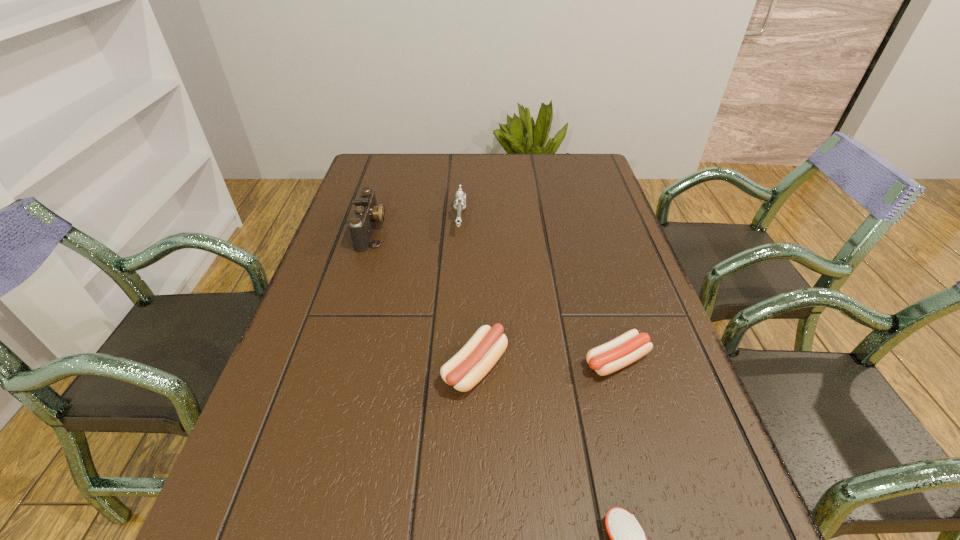
At what (x,y) coordinates should I click in order to perform the action: click on free spot between the third tallest object and the second shortest object. Please return your answer as a coordinate pair (x, y). Looking at the image, I should click on (546, 364).

Locate an element on the screen. The width and height of the screenshot is (960, 540). free space between the second shortest object and the taller sausage is located at coordinates (546, 364).

Image resolution: width=960 pixels, height=540 pixels. I want to click on free space between the camera and the shorter sausage, so click(x=494, y=295).

The height and width of the screenshot is (540, 960). Find the location of `unoccupied position between the leftmost object and the third tallest object`. unoccupied position between the leftmost object and the third tallest object is located at coordinates (423, 299).

Find the location of a particular element. free spot between the third shortest object and the gun is located at coordinates (468, 293).

Locate an element on the screen. This screenshot has height=540, width=960. the second closest object to the gun is located at coordinates (470, 365).

Identify which object is located as the second nearest to the shorter sausage. Please provide its 2D coordinates. Your answer should be formatted as a tuple, i.e. [(x, y)], where the tuple contains the x and y coordinates of a point satisfying the conditions above.

[(627, 537)]

Find the location of a particular element. Image resolution: width=960 pixels, height=540 pixels. vacant region that satisfies the following two spatial constraints: 1. aimed along the barrel of the gun; 2. on the front-facing side of the leftmost object is located at coordinates (460, 231).

Locate an element on the screen. This screenshot has height=540, width=960. free spot that satisfies the following two spatial constraints: 1. aimed along the barrel of the shorter sausage; 2. on the right side of the gun is located at coordinates (452, 361).

At what (x,y) coordinates should I click in order to perform the action: click on free space that satisfies the following two spatial constraints: 1. aimed along the barrel of the shorter sausage; 2. on the left side of the gun. Please return your answer as a coordinate pair (x, y). The height and width of the screenshot is (540, 960). Looking at the image, I should click on (452, 361).